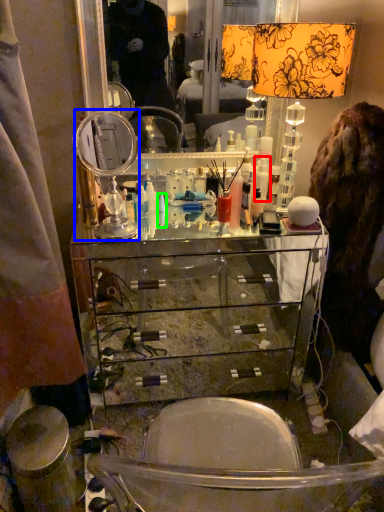
Question: Which object is positioned closest to toiletry (highlighted by a red box)? Select from table lamp (highlighted by a blue box) and toiletry (highlighted by a green box).

Choices:
 (A) table lamp
 (B) toiletry

Answer: (B)